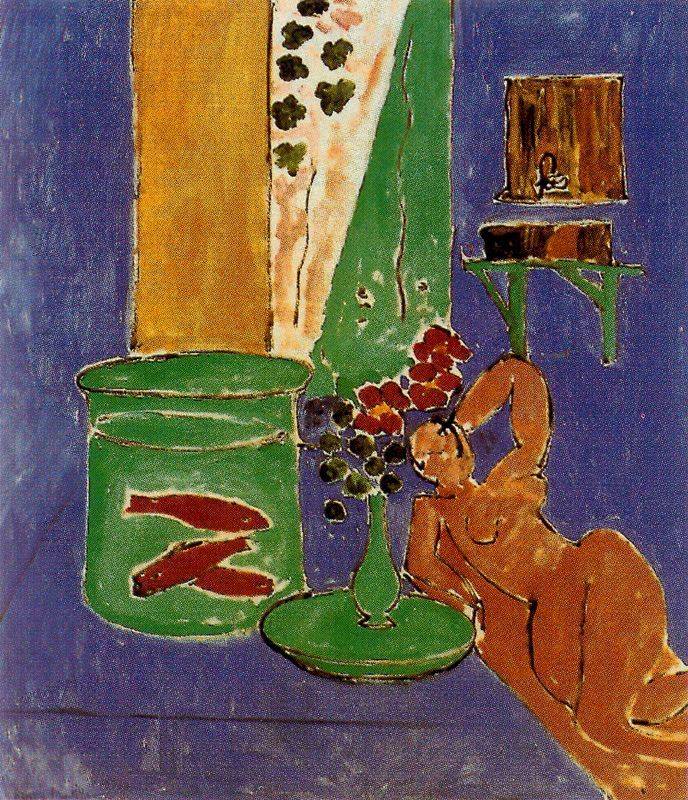
Locate an element on the screen. This screenshot has height=800, width=688. green flower vase is located at coordinates point(375,576).